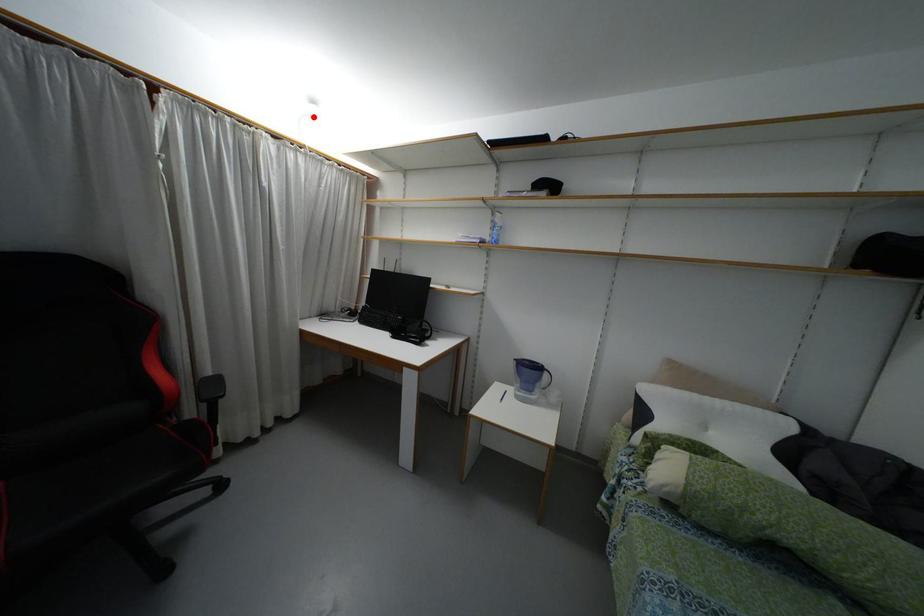
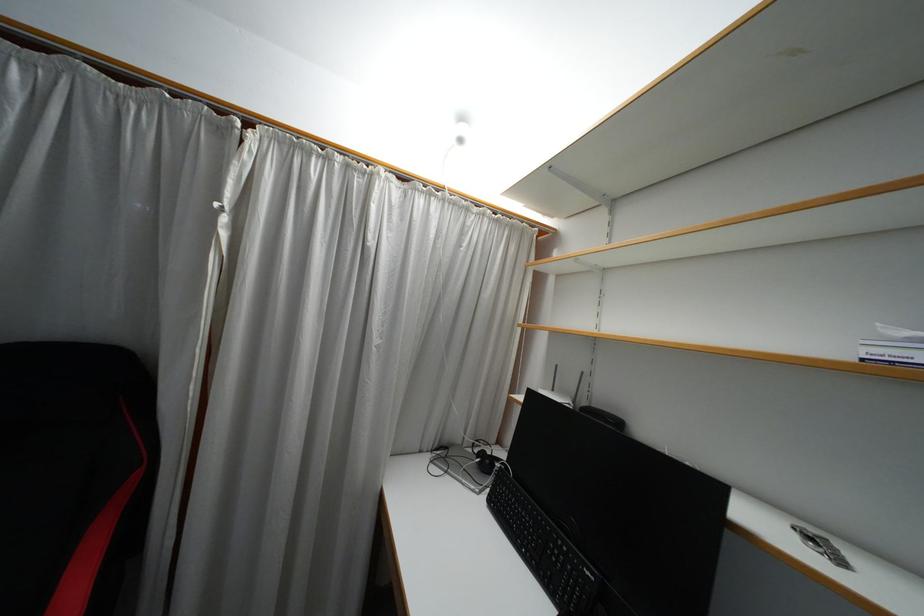
In the second image, find the point that corresponds to the highlighted location in the first image.

(459, 140)